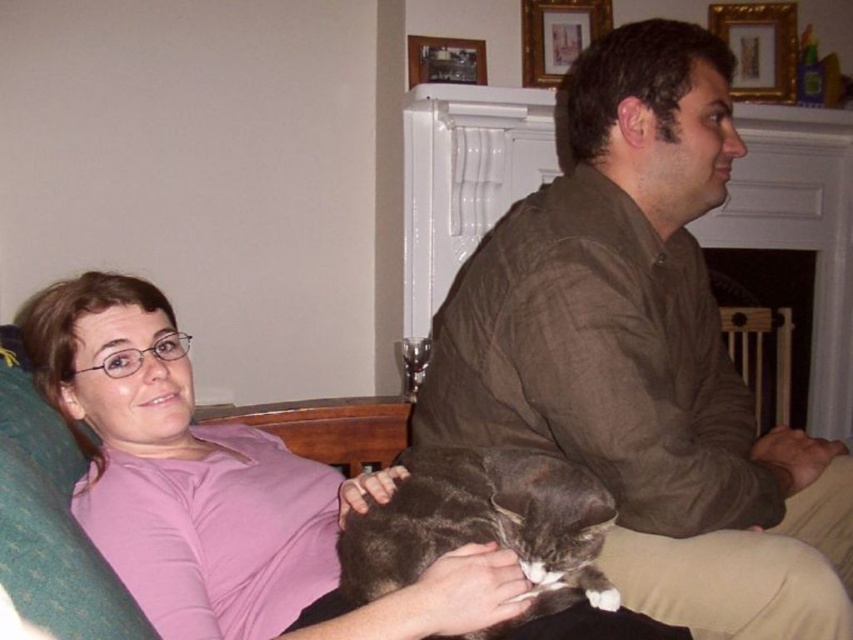
Question: Among these points, which one is farthest from the camera?

Choices:
 (A) (477, 58)
 (B) (532, 369)

Answer: (A)

Question: In this image, where is gold-framed picture at upper center located relative to wooden picture frame at upper center?

Choices:
 (A) above
 (B) below

Answer: (A)

Question: Is brown textured shirt at center to the right of wooden picture frame at upper center from the viewer's perspective?

Choices:
 (A) no
 (B) yes

Answer: (B)

Question: In this image, where is gray fur cat at center located relative to gold-framed picture at upper center?

Choices:
 (A) below
 (B) above

Answer: (A)

Question: Which point appears farthest from the camera in this image?

Choices:
 (A) (486, 406)
 (B) (151, 300)

Answer: (B)

Question: Which point is farther to the camera?

Choices:
 (A) wooden picture frame at upper center
 (B) brown textured shirt at center
 (C) gold-framed picture at upper center

Answer: (C)